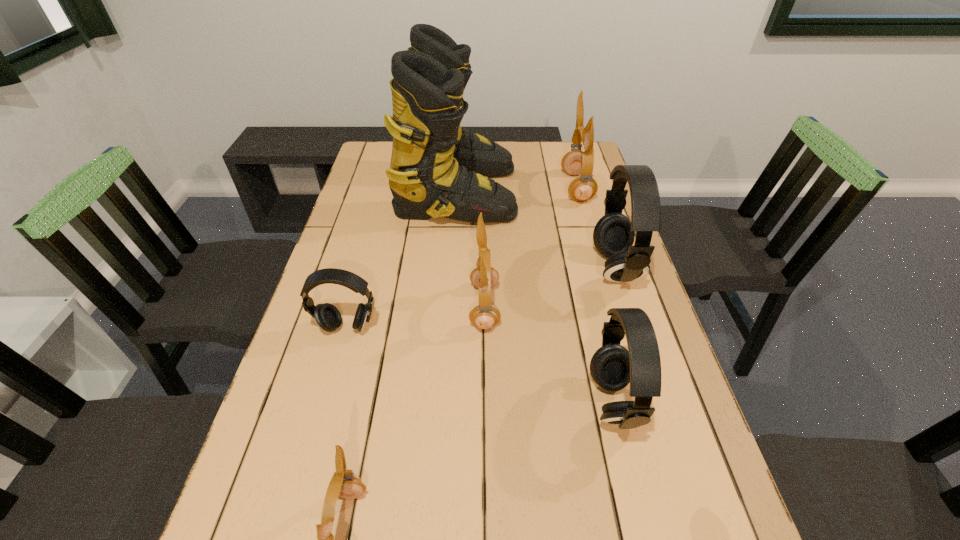
This screenshot has width=960, height=540. Find the location of `free space at the left edge of the desktop`. free space at the left edge of the desktop is located at coordinates (327, 372).

The image size is (960, 540). I want to click on blank space at the right edge of the desktop, so click(x=636, y=286).

Where is `vacant space in between the second brown earphone from right to left and the leftmost black earphone`? The image size is (960, 540). vacant space in between the second brown earphone from right to left and the leftmost black earphone is located at coordinates (416, 317).

Locate an element on the screen. free area in between the smallest black earphone and the tallest object is located at coordinates (402, 260).

I want to click on empty space between the second nearest black earphone and the tallest object, so click(x=402, y=260).

Where is `vacant point located between the biggest brown earphone and the ski boots`? vacant point located between the biggest brown earphone and the ski boots is located at coordinates (516, 190).

Locate an element on the screen. The width and height of the screenshot is (960, 540). free space between the biggest brown earphone and the second biggest brown earphone is located at coordinates (531, 247).

Locate which object ranks fourth in proximity to the nearest earphone. Please provide its 2D coordinates. Your answer should be formatted as a tuple, i.e. [(x, y)], where the tuple contains the x and y coordinates of a point satisfying the conditions above.

[(613, 236)]

Select which object is the closest to the ski boots. Please provide its 2D coordinates. Your answer should be formatted as a tuple, i.e. [(x, y)], where the tuple contains the x and y coordinates of a point satisfying the conditions above.

[(583, 188)]

Locate an element on the screen. Image resolution: width=960 pixels, height=540 pixels. the closest earphone to the farthest black earphone is located at coordinates (583, 188).